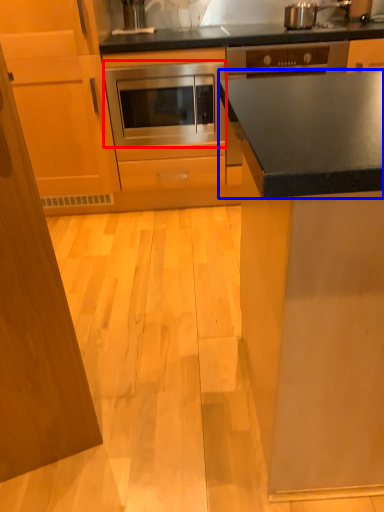
Question: Which object appears closest to the camera in this image, oven (highlighted by a red box) or countertop (highlighted by a blue box)?

Choices:
 (A) oven
 (B) countertop

Answer: (B)